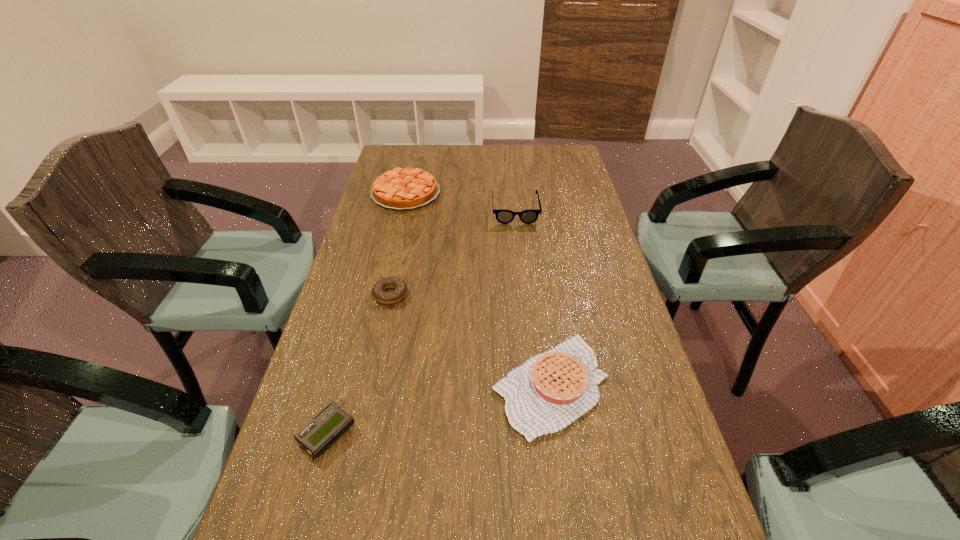
Identify the location of vacant area that satisfies the following two spatial constraints: 1. on the back side of the doughnut; 2. on the right side of the beeper. (365, 294).

The width and height of the screenshot is (960, 540). In order to click on blank space that satisfies the following two spatial constraints: 1. on the arms of the right pie; 2. on the right side of the spectacles in this screenshot , I will do `click(534, 385)`.

At what (x,y) coordinates should I click in order to perform the action: click on free space that satisfies the following two spatial constraints: 1. on the arms of the tallest object; 2. on the right side of the nearer pie. Please return your answer as a coordinate pair (x, y). The height and width of the screenshot is (540, 960). Looking at the image, I should click on (534, 385).

The width and height of the screenshot is (960, 540). In order to click on free spot that satisfies the following two spatial constraints: 1. on the back side of the left pie; 2. on the right side of the beeper in this screenshot , I will do `click(394, 193)`.